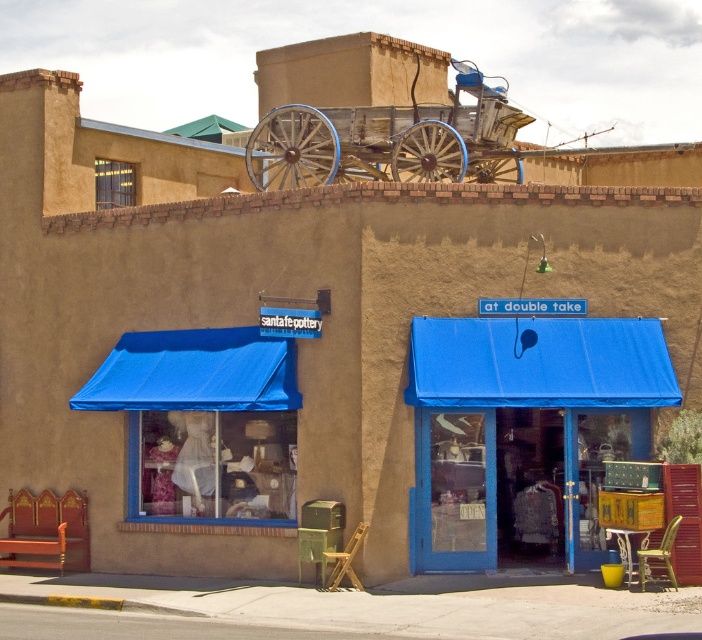
Question: Among these points, which one is nearest to the camera?

Choices:
 (A) (621, 349)
 (B) (435, 157)

Answer: (A)

Question: Which of the following is the farthest from the observer?

Choices:
 (A) blue fabric awning at center
 (B) weathered wood cart at upper center

Answer: (B)

Question: Can you confirm if blue fabric awning at center is smaller than weathered wood cart at upper center?

Choices:
 (A) no
 (B) yes

Answer: (B)

Question: Is blue fabric awning at center below weathered wood cart at upper center?

Choices:
 (A) yes
 (B) no

Answer: (A)

Question: Does blue fabric awning at center have a larger size compared to weathered wood cart at upper center?

Choices:
 (A) no
 (B) yes

Answer: (A)